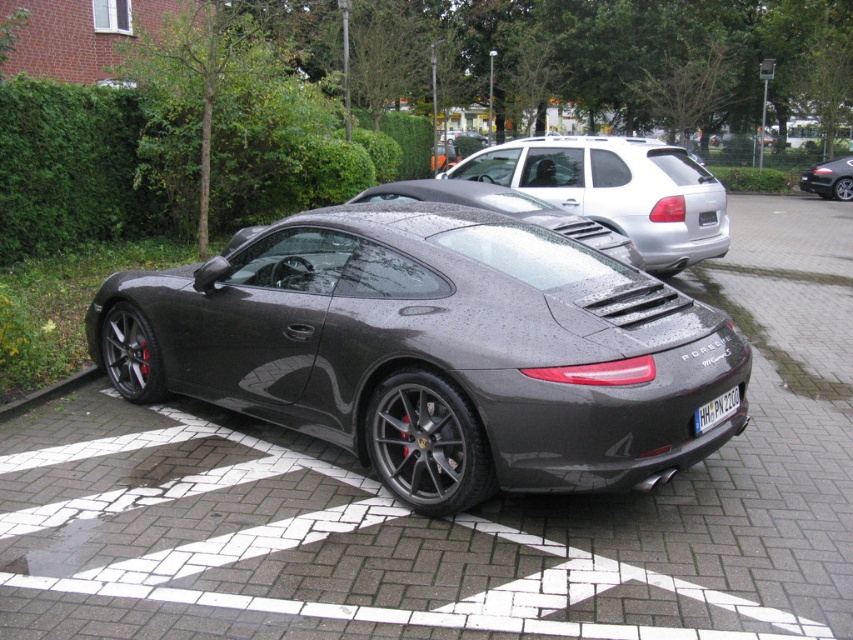
Question: Which object appears closest to the camera in this image?

Choices:
 (A) gray concrete curb at lower left
 (B) shiny black car at center
 (C) satin silver metallic suv at upper right

Answer: (A)

Question: Does satin black sports car at center have a larger size compared to satin silver metallic suv at upper right?

Choices:
 (A) yes
 (B) no

Answer: (B)

Question: Is satin black sports car at center above satin silver metallic suv at upper right?

Choices:
 (A) yes
 (B) no

Answer: (B)

Question: Which object is closer to the camera taking this photo?

Choices:
 (A) shiny black car at center
 (B) black plastic license plate at center
 (C) gray concrete curb at lower left
 (D) satin silver metallic suv at upper right

Answer: (B)

Question: Estimate the real-world distances between objects in this image. Which object is closer to the gray concrete curb at lower left?

Choices:
 (A) satin silver metallic suv at upper right
 (B) shiny black car at center
 (C) satin black sports car at center

Answer: (C)

Question: Is satin silver metallic suv at upper right to the right of gray concrete curb at lower left from the viewer's perspective?

Choices:
 (A) no
 (B) yes

Answer: (B)